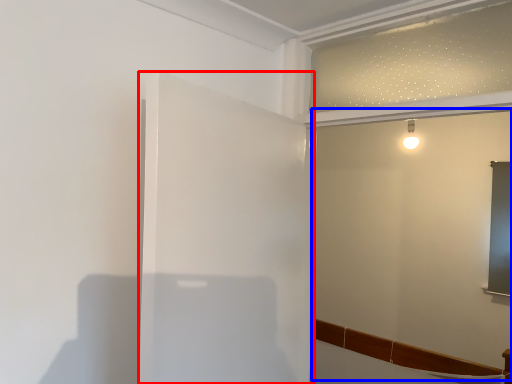
Question: Which object appears farthest to the camera in this image, screen door (highlighted by a red box) or backdrop (highlighted by a blue box)?

Choices:
 (A) screen door
 (B) backdrop

Answer: (B)